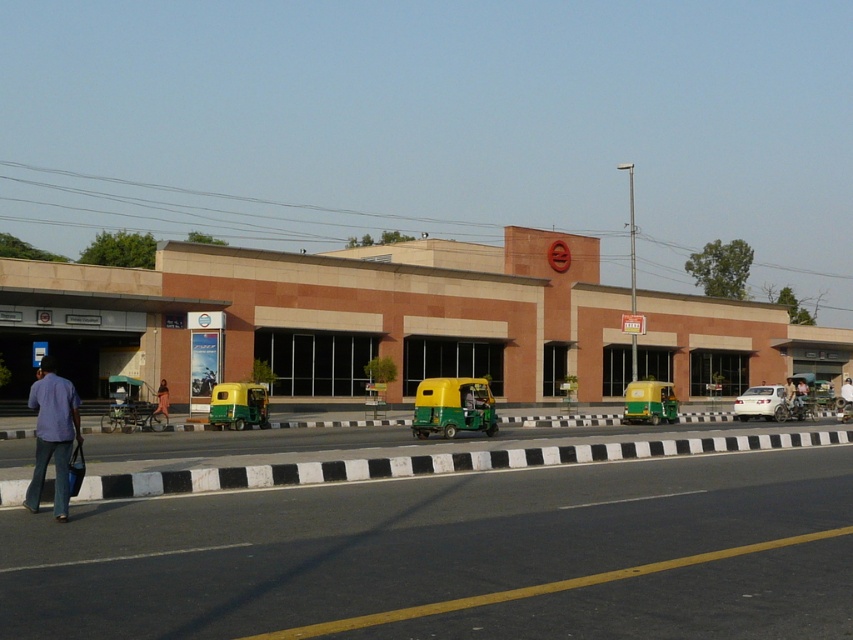
You are standing at the pedestrian crossing in front of the modern building. There are two points marked on the building facade. One is at coordinate point [73,392] and the other at point [840,392]. Which point is closer to you?

Point [73,392] is closer to the viewer than point [840,392].

You are a fashion designer observing a street scene. You notice the denim pants at lower left and the pink fabric dress at center. Which clothing item appears bigger in size?

The denim pants at lower left has a larger size compared to the pink fabric dress at center.

You are a pedestrian standing at the crosswalk in front of the brick building at center and the white matte car at center. Which object is closer to the crosswalk?

The brick building at center is positioned on the left side of the white matte car at center, so the brick building at center is closer to the crosswalk.